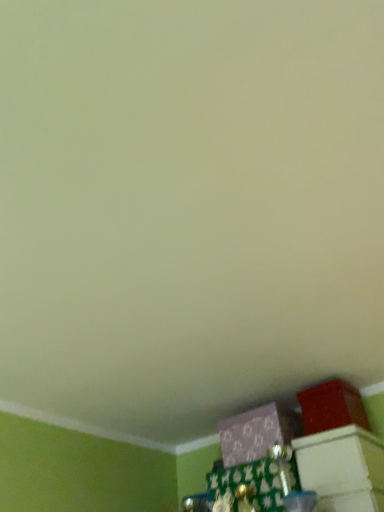
Question: Is matte red box at lower right, positioned as the 1th box in right-to-left order, wider or thinner than purple matte box at lower center, the second box when ordered from right to left?

Choices:
 (A) thin
 (B) wide

Answer: (A)

Question: Considering the positions of point (312, 429) and point (266, 430), is point (312, 429) closer or farther from the camera than point (266, 430)?

Choices:
 (A) closer
 (B) farther

Answer: (A)

Question: From a real-world perspective, is matte red box at lower right, positioned as the 1th box in right-to-left order, positioned above or below purple matte box at lower center, which ranks as the 1th box in left-to-right order?

Choices:
 (A) below
 (B) above

Answer: (B)

Question: Considering the positions of purple matte box at lower center, which ranks as the 1th box in left-to-right order, and matte red box at lower right, positioned as the 1th box in right-to-left order, in the image, is purple matte box at lower center, which ranks as the 1th box in left-to-right order, wider or thinner than matte red box at lower right, positioned as the 1th box in right-to-left order,?

Choices:
 (A) thin
 (B) wide

Answer: (B)

Question: Considering their positions, is purple matte box at lower center, the second box when ordered from right to left, located in front of or behind matte red box at lower right, positioned as the 1th box in right-to-left order?

Choices:
 (A) behind
 (B) front

Answer: (A)

Question: Does point (240, 459) appear closer or farther from the camera than point (327, 416)?

Choices:
 (A) closer
 (B) farther

Answer: (B)

Question: In the image, is purple matte box at lower center, which ranks as the 1th box in left-to-right order, on the left side or the right side of matte red box at lower right, positioned as the 1th box in right-to-left order?

Choices:
 (A) right
 (B) left

Answer: (B)